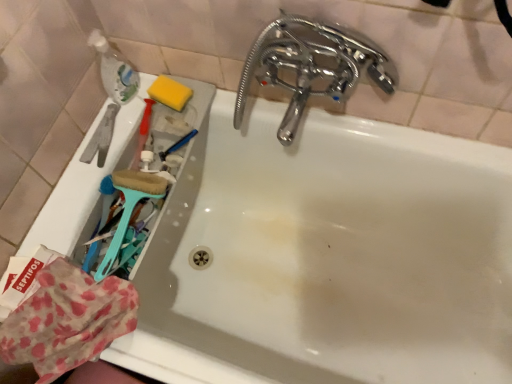
Locate an element on the screen. The image size is (512, 384). unoccupied space behind teal plastic brush at left is located at coordinates (x=122, y=170).